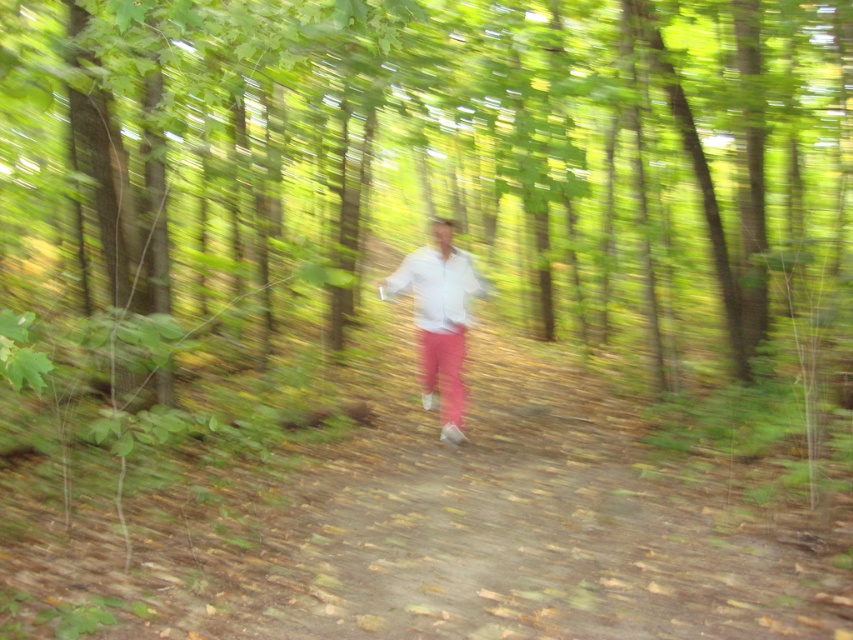
Based on the scene description, can you determine if the green leafy tree at center is wider than the white matte shirt at center?

The green leafy tree at center might be wider than white matte shirt at center according to the description.

You are a photographer trying to capture the person in the white matte shirt at center without the green leafy tree at center blocking them. Can you adjust your position to achieve this?

The green leafy tree at center is in front of the white matte shirt at center, so you cannot adjust your position to avoid the tree blocking the shirt without moving the tree or the shirt.